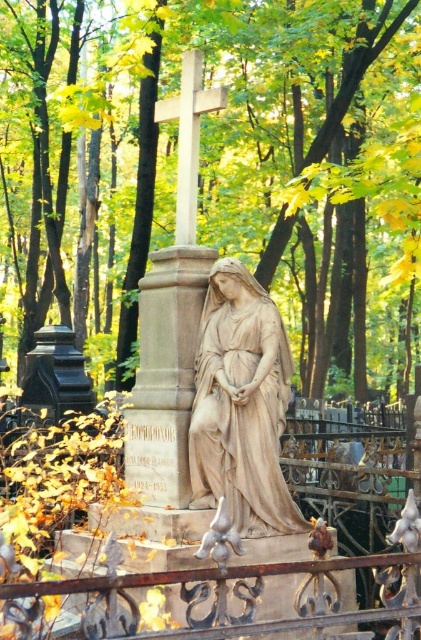
Question: Does beige stone statue at center appear on the left side of white stone cross at center?

Choices:
 (A) yes
 (B) no

Answer: (B)

Question: Where is green leafy tree at center located in relation to white stone cross at center in the image?

Choices:
 (A) right
 (B) left

Answer: (A)

Question: Which point appears closest to the camera in this image?

Choices:
 (A) (200, 104)
 (B) (226, 342)
 (C) (407, 627)
 (D) (367, 157)

Answer: (C)

Question: Which point is farther from the camera taking this photo?

Choices:
 (A) (181, 128)
 (B) (130, 579)
 (C) (312, 374)

Answer: (C)

Question: Which point is closer to the camera?

Choices:
 (A) beige stone statue at center
 (B) brown wrought iron fence at lower center
 (C) white stone cross at center

Answer: (B)

Question: Does green leafy tree at center appear under brown wrought iron fence at lower center?

Choices:
 (A) no
 (B) yes

Answer: (A)